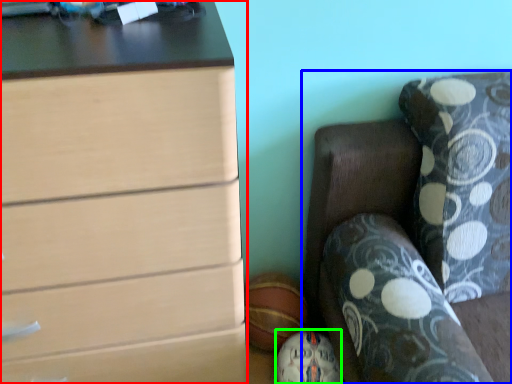
Question: Which object is positioned farthest from chest of drawers (highlighted by a red box)? Select from furniture (highlighted by a blue box) and sports equipment (highlighted by a green box).

Choices:
 (A) furniture
 (B) sports equipment

Answer: (B)